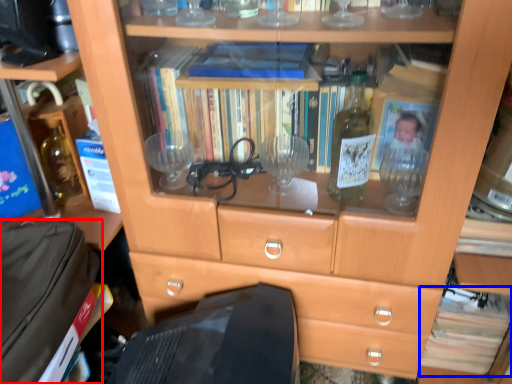
Question: Which point is further to the camera, luggage (highlighted by a red box) or book (highlighted by a blue box)?

Choices:
 (A) luggage
 (B) book

Answer: (B)